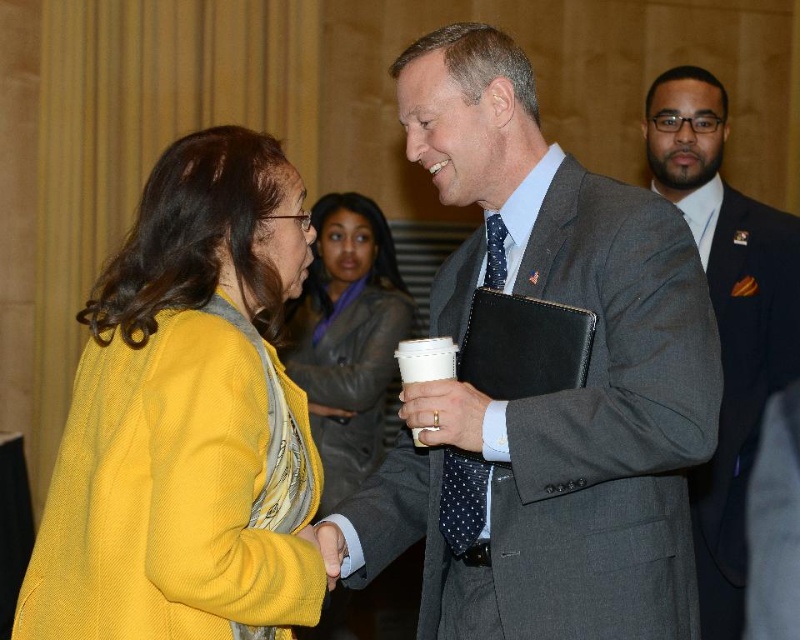
Question: Does yellow corduroy jacket at center appear over yellow fabric hand at center?

Choices:
 (A) yes
 (B) no

Answer: (A)

Question: Which of the following is the farthest from the observer?

Choices:
 (A) (713, 570)
 (B) (498, 100)
 (C) (360, 317)

Answer: (C)

Question: Is polka dot silk tie at center to the right of yellow fabric hand at center from the viewer's perspective?

Choices:
 (A) no
 (B) yes

Answer: (B)

Question: Considering the relative positions of yellow corduroy jacket at left and yellow fabric hand at center in the image provided, where is yellow corduroy jacket at left located with respect to yellow fabric hand at center?

Choices:
 (A) left
 (B) right

Answer: (A)

Question: Which of the following is the closest to the observer?

Choices:
 (A) yellow fabric hand at center
 (B) yellow corduroy jacket at center
 (C) gray suit at center
 (D) matte plastic cup at center

Answer: (A)

Question: Estimate the real-world distances between objects in this image. Which object is farther from the yellow fabric hand at center?

Choices:
 (A) dark gray suit at right
 (B) polka dot silk tie at center

Answer: (A)